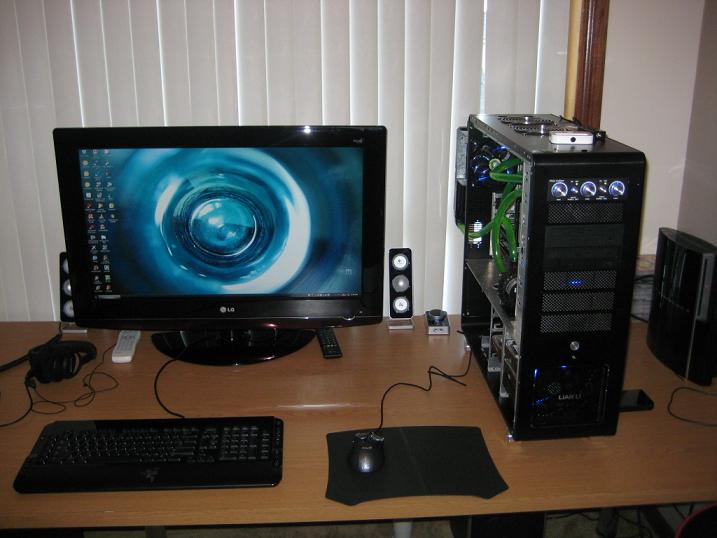
Find the location of a particular element. The height and width of the screenshot is (538, 717). window blinds is located at coordinates (444, 59).